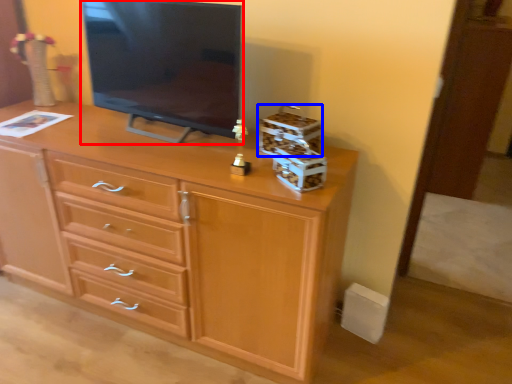
Question: Which point is closer to the camera, television (highlighted by a red box) or storage box (highlighted by a blue box)?

Choices:
 (A) television
 (B) storage box

Answer: (A)